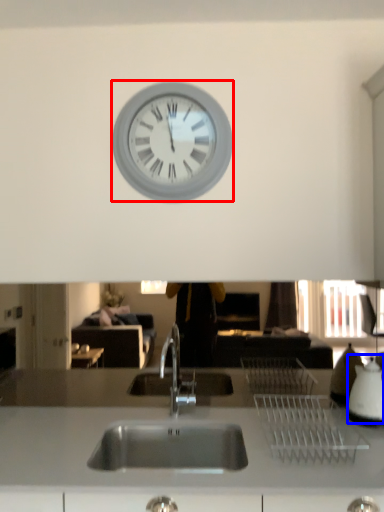
Question: Among these objects, which one is nearest to the camera, wall clock (highlighted by a red box) or appliance (highlighted by a blue box)?

Choices:
 (A) wall clock
 (B) appliance

Answer: (B)